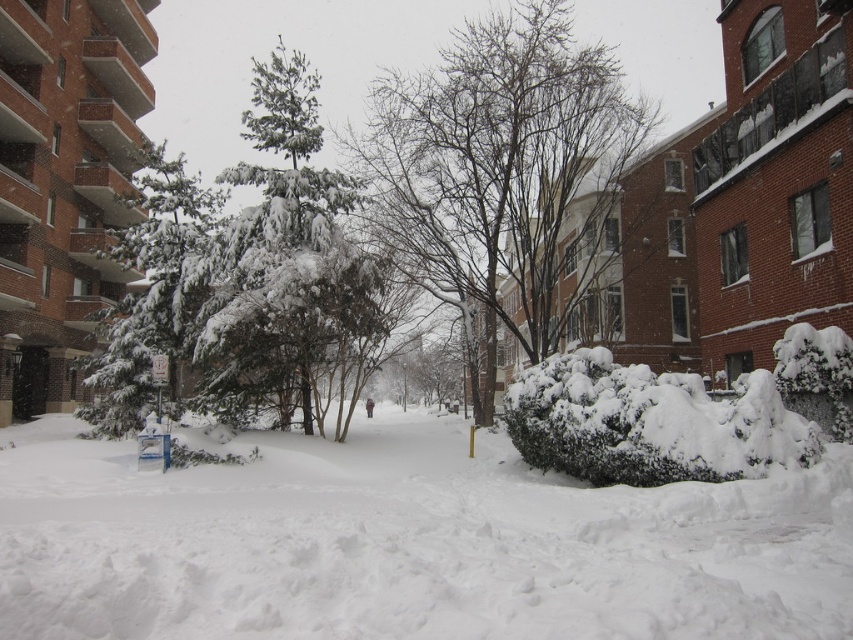
You are standing in the snowy urban scene. There is a point marked at coordinates (407,541). What is located at that point?

The point at coordinates (407,541) indicates white fluffy snow at center.